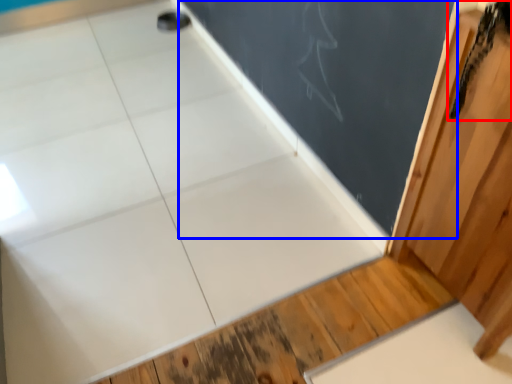
Question: Among these objects, which one is nearest to the camera, animal (highlighted by a red box) or bulletin board (highlighted by a blue box)?

Choices:
 (A) animal
 (B) bulletin board

Answer: (A)